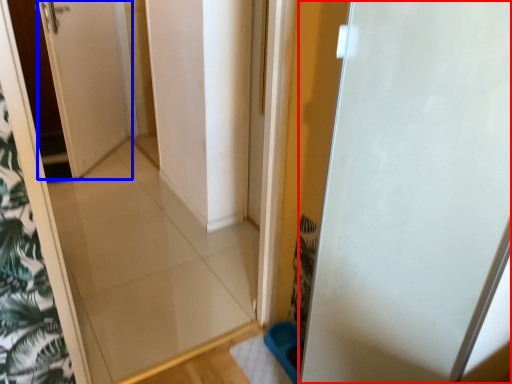
Question: Among these objects, which one is nearest to the camera, door (highlighted by a red box) or door (highlighted by a blue box)?

Choices:
 (A) door
 (B) door

Answer: (A)